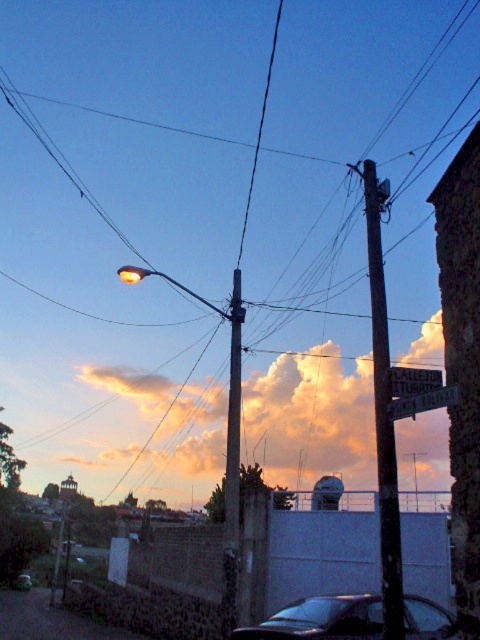
Does wooden telephone pole at center appear on the left side of shiny black car at lower center?

No, wooden telephone pole at center is not to the left of shiny black car at lower center.

Does wooden telephone pole at center have a smaller size compared to shiny black car at lower center?

Actually, wooden telephone pole at center might be larger than shiny black car at lower center.

This screenshot has height=640, width=480. What are the coordinates of `wooden telephone pole at center` in the screenshot? It's located at (383, 410).

Is matte metal street light at upper left bigger than metallic silver street sign at upper right?

Yes.

Does matte metal street light at upper left appear over metallic silver street sign at upper right?

Actually, matte metal street light at upper left is below metallic silver street sign at upper right.

Does point (130, 268) lie in front of point (420, 401)?

No, it is behind (420, 401).

Locate an element on the screen. The image size is (480, 640). matte metal street light at upper left is located at coordinates (227, 436).

Does wooden telephone pole at center lie behind metallic silver sign at upper center?

Yes, wooden telephone pole at center is behind metallic silver sign at upper center.

Between point (381, 554) and point (402, 388), which one is positioned behind?

Positioned behind is point (381, 554).

Locate an element on the screen. The height and width of the screenshot is (640, 480). wooden telephone pole at center is located at coordinates (383, 410).

In order to click on wooden telephone pole at center in this screenshot , I will do [x=383, y=410].